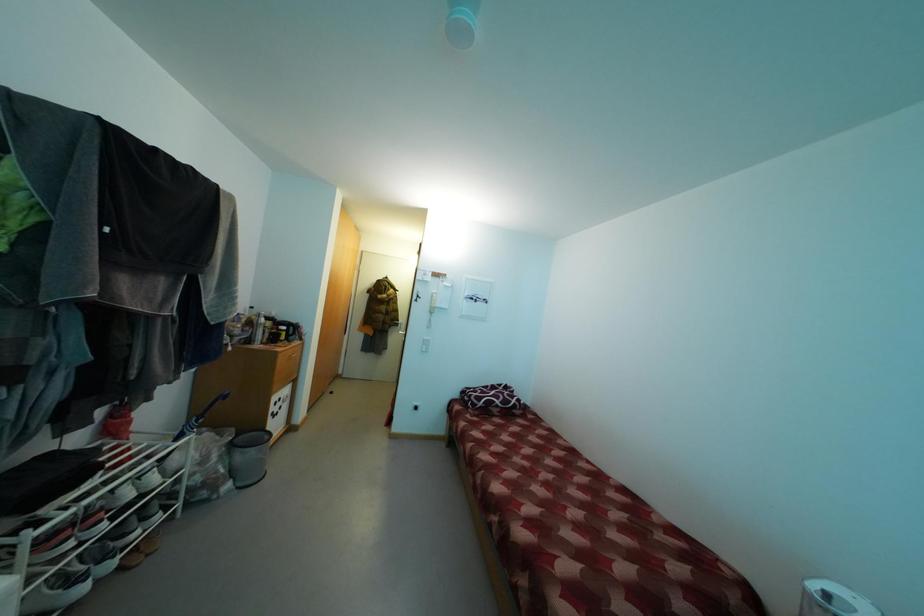
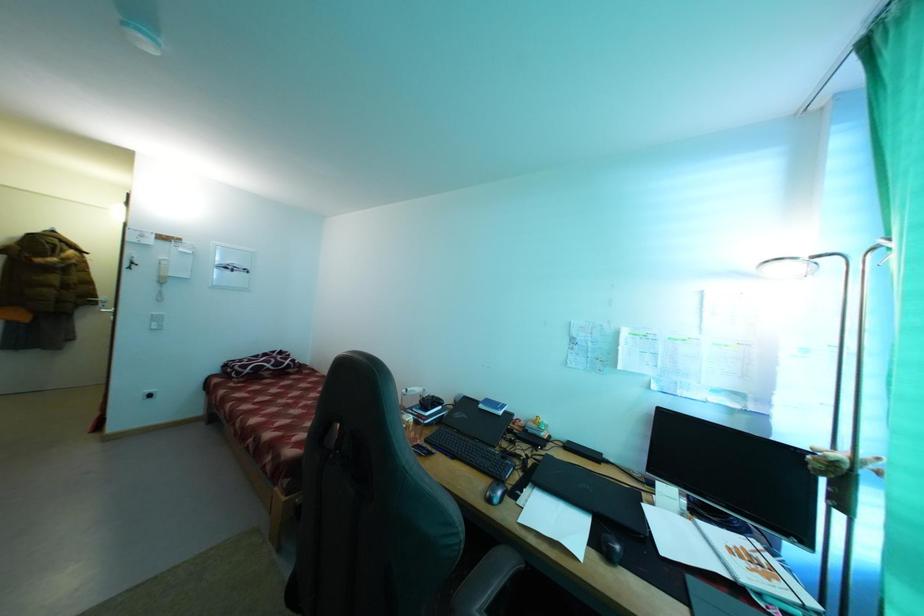
Question: How did the camera likely rotate?

Choices:
 (A) Left
 (B) Right
 (C) Up
 (D) Down

Answer: (B)